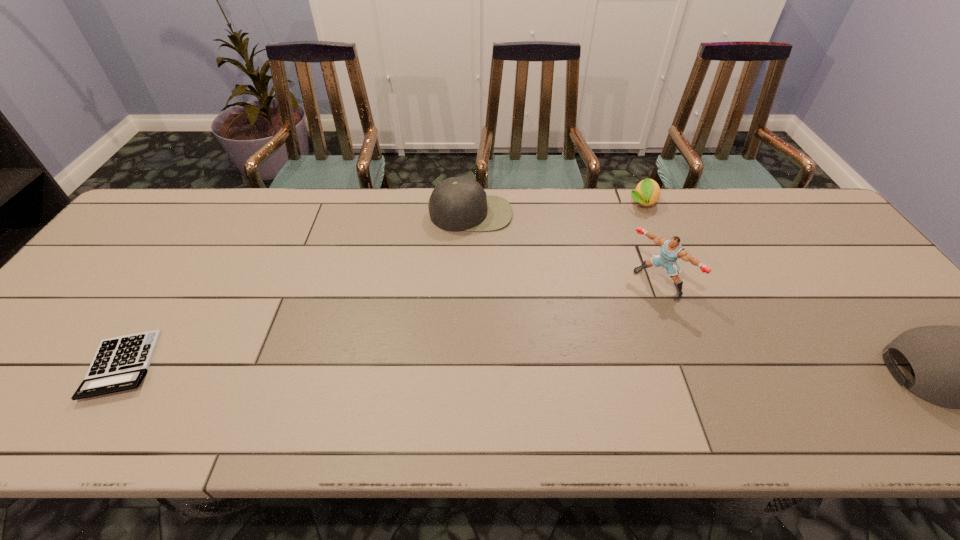
This screenshot has width=960, height=540. I want to click on object that ranks as the closest to the second shortest object, so click(x=671, y=250).

Locate which object is the closest to the tallest object. Please provide its 2D coordinates. Your answer should be formatted as a tuple, i.e. [(x, y)], where the tuple contains the x and y coordinates of a point satisfying the conditions above.

[(647, 192)]

The width and height of the screenshot is (960, 540). Find the location of `vacant region that satisfies the following two spatial constraints: 1. on the back side of the third nearest object; 2. on the right side of the shortest object`. vacant region that satisfies the following two spatial constraints: 1. on the back side of the third nearest object; 2. on the right side of the shortest object is located at coordinates (176, 283).